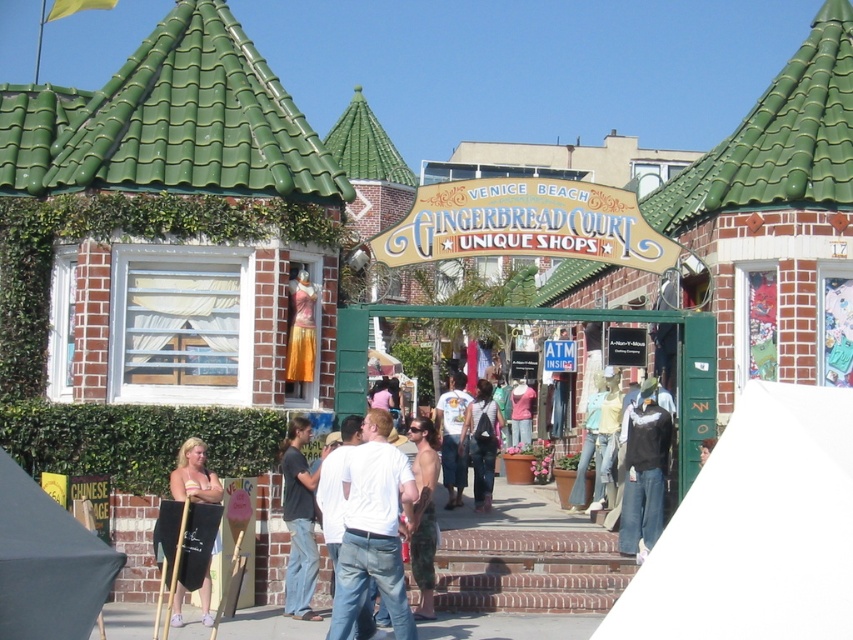
You are a photographer planning to capture the entrance of Venice Beach Gingerbread Court. You notice the dark gray fabric canopy at lower left and the white cotton shirt at center. Which object would cast a wider shadow on the ground?

The dark gray fabric canopy at lower left would cast a wider shadow on the ground because its width is larger than the white cotton shirt at center.

From the picture: You are standing at the entrance of Venice Beach Gingerbread Court and see a dark gray sweater at center. Where is the dark gray sweater located relative to the entrance?

The dark gray sweater at center is located at the point (643, 470) relative to the entrance.